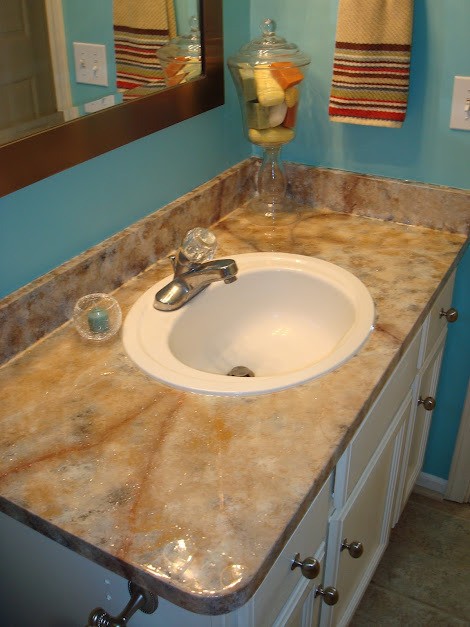
Find the location of a particular element. The image size is (470, 627). light switch is located at coordinates (461, 116).